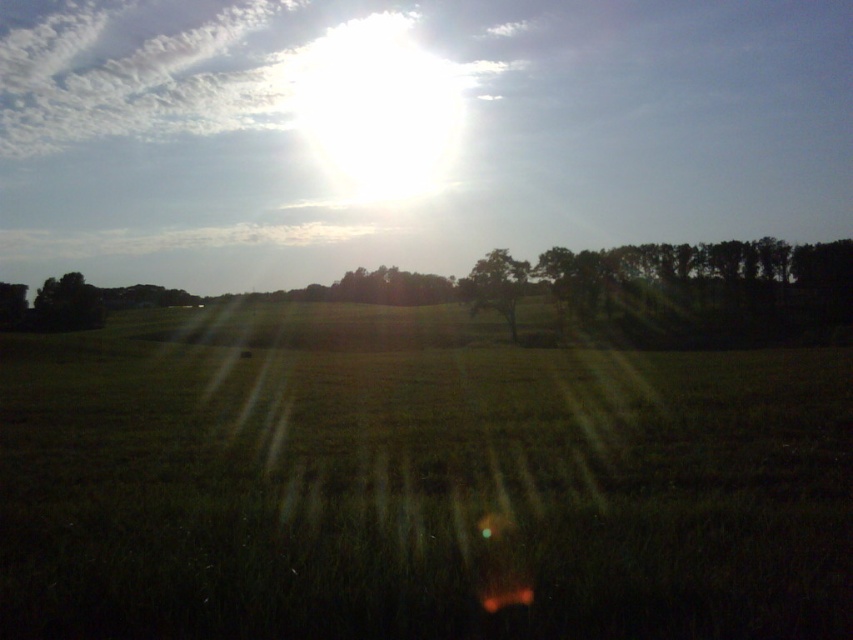
Question: Which point is closer to the camera?

Choices:
 (A) dark green leafy tree at left
 (B) green grass at center
 (C) green leafy tree at center

Answer: (B)

Question: Can you confirm if green grass at center is smaller than dark green leafy tree at left?

Choices:
 (A) yes
 (B) no

Answer: (B)

Question: Is green grass at center below dark green leafy tree at left?

Choices:
 (A) no
 (B) yes

Answer: (B)

Question: Which point is closer to the camera taking this photo?

Choices:
 (A) (53, 291)
 (B) (492, 304)

Answer: (B)

Question: Does green grass at center lie behind green leafy tree at center?

Choices:
 (A) no
 (B) yes

Answer: (A)

Question: Based on their relative distances, which object is farther from the green grass at center?

Choices:
 (A) green leafy tree at center
 (B) dark green leafy tree at left

Answer: (B)